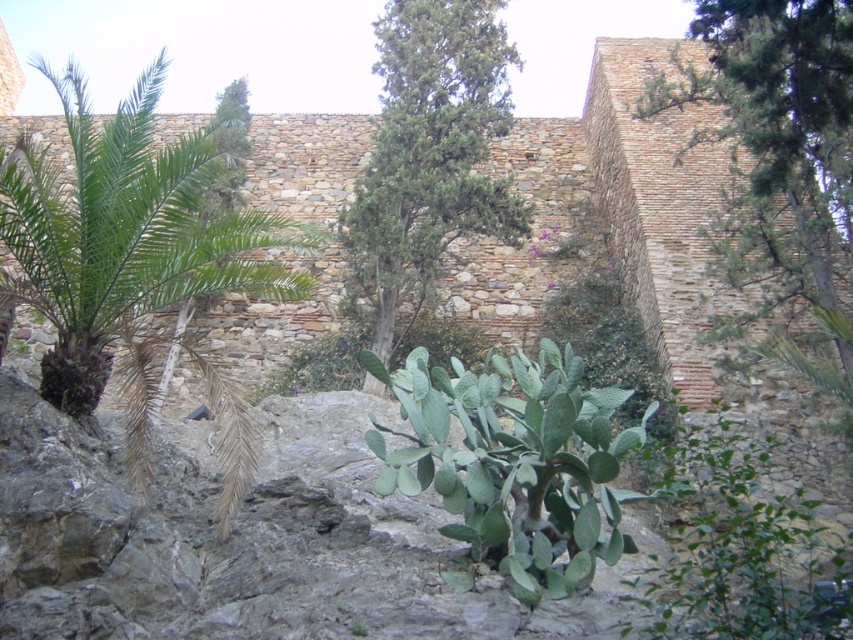
Does point (672, 58) come farther from viewer compared to point (381, 260)?

Yes, it is.

This screenshot has width=853, height=640. In order to click on green leafy tree at upper right in this screenshot , I will do `click(776, 141)`.

Based on the photo, who is positioned more to the right, green leafy palm at left or green leafy tree at center?

green leafy tree at center is more to the right.

Between point (144, 113) and point (509, 116), which one is positioned behind?

Point (509, 116)

Identify the location of green leafy palm at left. (126, 244).

Between point (91, 369) and point (833, 77), which one is positioned in front?

Point (91, 369)

Does green leafy palm at left have a smaller size compared to green leafy tree at upper right?

No.

Who is more forward, (76, 236) or (733, 230)?

Point (76, 236) is in front.

Image resolution: width=853 pixels, height=640 pixels. Find the location of `green leafy palm at left`. green leafy palm at left is located at coordinates (126, 244).